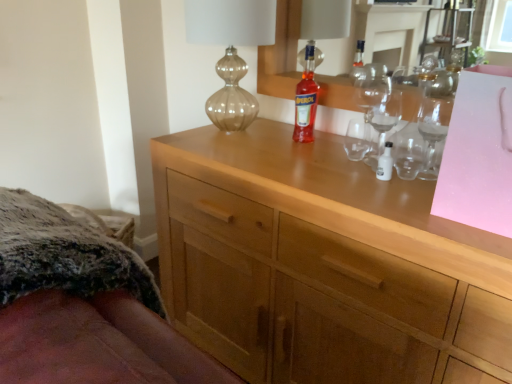
This screenshot has width=512, height=384. What are the coordinates of `empty space that is to the right of translucent glass vase at upper center` in the screenshot? It's located at (303, 140).